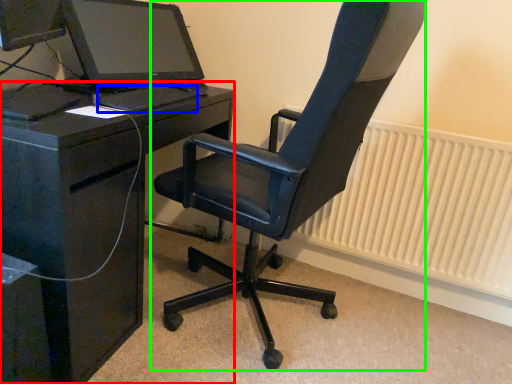
Question: Which object is positioned farthest from desk (highlighted by a red box)? Select from computer keyboard (highlighted by a blue box) and chair (highlighted by a green box).

Choices:
 (A) computer keyboard
 (B) chair

Answer: (B)